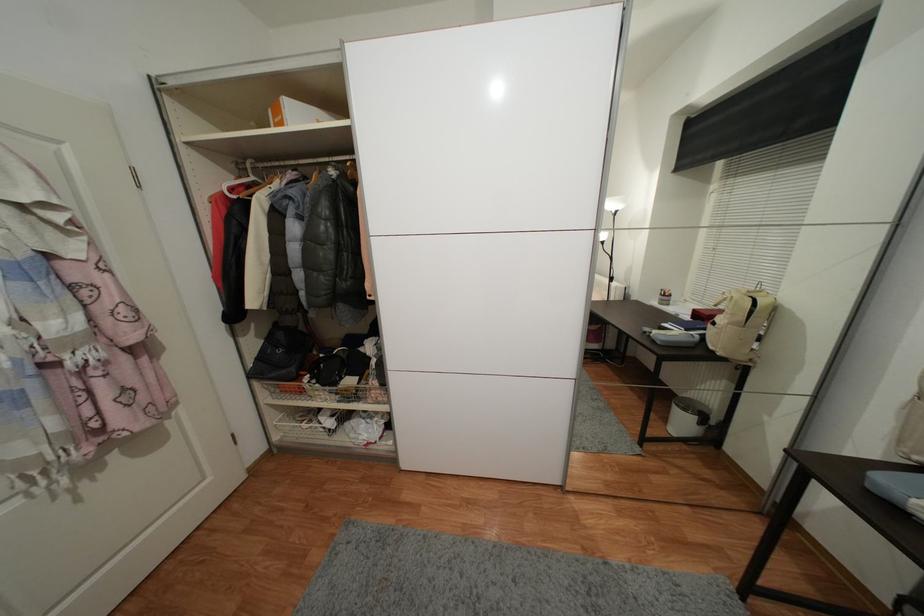
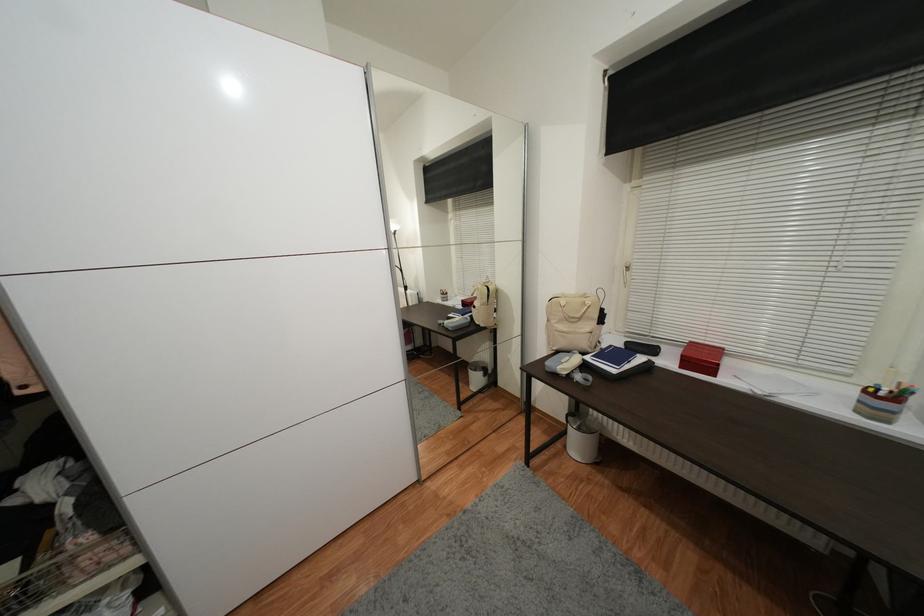
Question: The first image is from the beginning of the video and the second image is from the end. How did the camera likely rotate when shooting the video?

Choices:
 (A) Left
 (B) Right
 (C) Up
 (D) Down

Answer: (B)